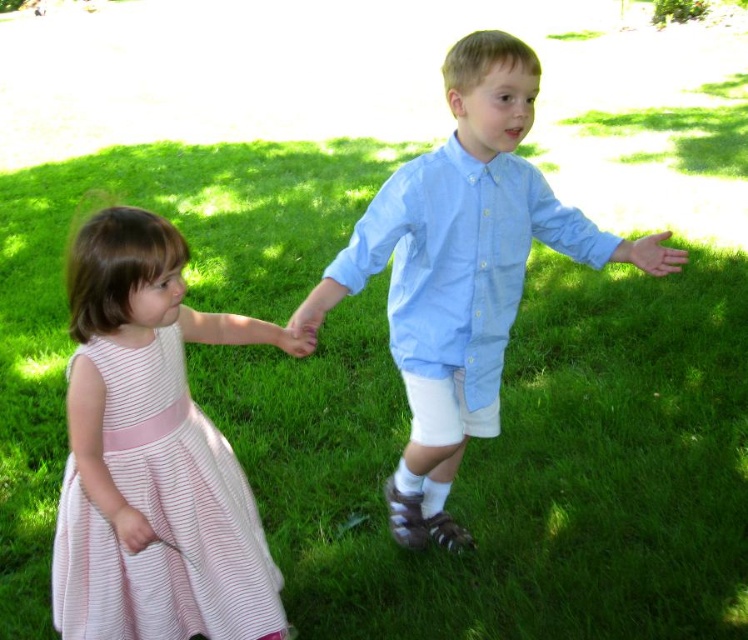
Question: Can you confirm if light blue cotton shirt at center is positioned to the left of pink striped fabric dress at left?

Choices:
 (A) no
 (B) yes

Answer: (A)

Question: Is light blue cotton shirt at center to the right of pink striped fabric dress at left from the viewer's perspective?

Choices:
 (A) yes
 (B) no

Answer: (A)

Question: Is light blue cotton shirt at center in front of pink striped fabric dress at left?

Choices:
 (A) yes
 (B) no

Answer: (B)